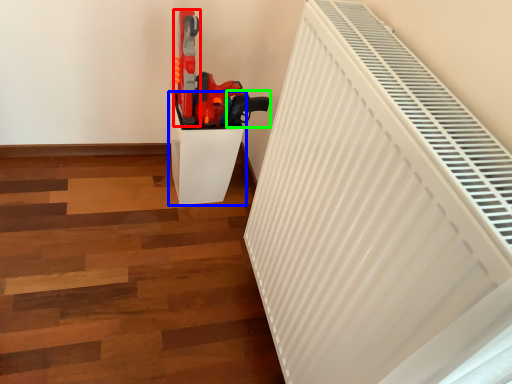
Question: Which is nearer to the equipment (highlighted by a red box)? furniture (highlighted by a blue box) or weapon (highlighted by a green box).

Choices:
 (A) furniture
 (B) weapon

Answer: (A)